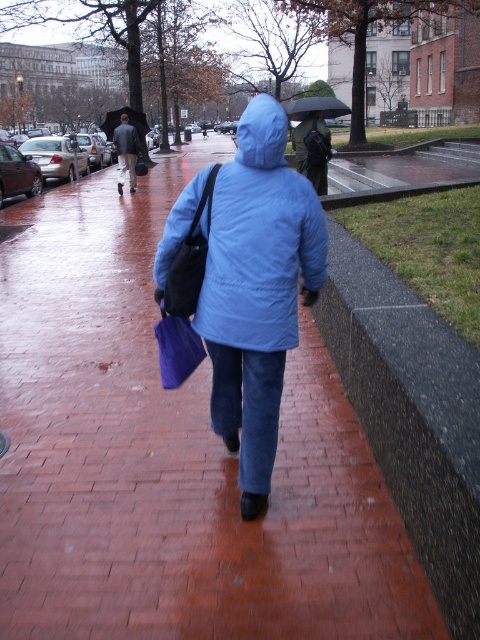
Is matte black jacket at upper left bigger than black matte umbrella at upper center?

No.

You are a GUI agent. You are given a task and a screenshot of the screen. Output one action in this format:
    pyautogui.click(x=<x>, y=<y>)
    Task: Click on the matte black jacket at upper left
    This screenshot has height=640, width=480.
    Given the screenshot: What is the action you would take?
    pyautogui.click(x=126, y=152)

You are a GUI agent. You are given a task and a screenshot of the screen. Output one action in this format:
    pyautogui.click(x=<x>, y=<y>)
    Task: Click on the matte black jacket at upper left
    
    Given the screenshot: What is the action you would take?
    pyautogui.click(x=126, y=152)

You are a GUI agent. You are given a task and a screenshot of the screen. Output one action in this format:
    pyautogui.click(x=<x>, y=<y>)
    Task: Click on the matte black jacket at upper left
    Image resolution: width=480 pixels, height=640 pixels.
    Given the screenshot: What is the action you would take?
    pyautogui.click(x=126, y=152)

Can you confirm if matte blue jacket at center is positioned above black matte umbrella at upper center?

No, matte blue jacket at center is not above black matte umbrella at upper center.

Is point (262, 156) closer to viewer compared to point (290, 109)?

That is True.

The height and width of the screenshot is (640, 480). In order to click on matte blue jacket at center in this screenshot , I will do `click(261, 241)`.

Between brick pavement at center and matte black jacket at upper left, which one has less height?

Standing shorter between the two is matte black jacket at upper left.

Does brick pavement at center have a larger size compared to matte black jacket at upper left?

Indeed, brick pavement at center has a larger size compared to matte black jacket at upper left.

Does point (12, 464) come behind point (131, 132)?

No.

This screenshot has width=480, height=640. In order to click on brick pavement at center in this screenshot , I will do `click(170, 456)`.